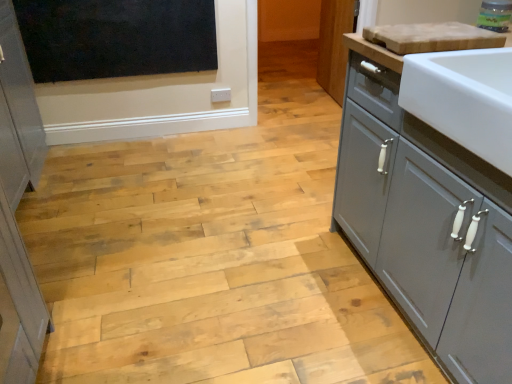
Where is `vacant area that is in front of light brown wood cutting board at upper right`? The image size is (512, 384). vacant area that is in front of light brown wood cutting board at upper right is located at coordinates (450, 58).